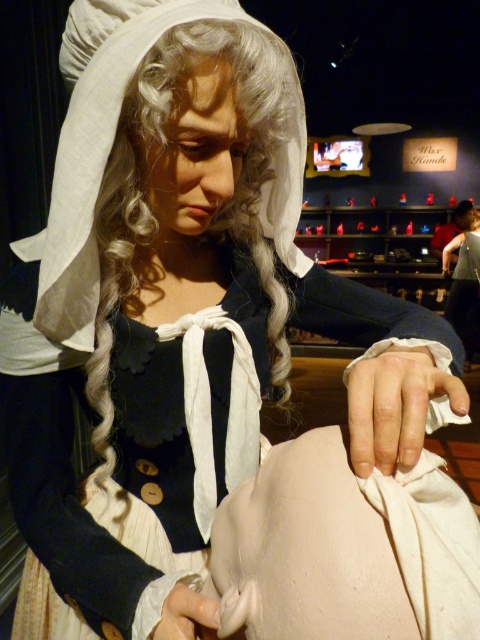
You are an art student analyzing the positioning of two points on a wax figure sculpture. The points are labeled as point (213, 33) and point (465, 292). Based on the sculpture, which point is nearer to your viewpoint?

Point (213, 33) is closer to the viewer than point (465, 292).

You are a museum curator planning to move the white silky hair at center closer to the matte white wig at upper left to create a more cohesive display. Given that the minimum required distance between any two exhibits is 3 meters for visitor safety, will the new arrangement comply with safety regulations?

The current distance between the white silky hair at center and the matte white wig at upper left is 5.33 meters. To comply with the 3 meter safety requirement, moving them closer would still maintain the distance above the minimum requirement. However, the question is about whether the new arrangement after moving would still comply. Since the minimum is 3 meters, as long as they are not placed closer than that, it is acceptable. The answer should focus on whether moving them closer would still keep them 3